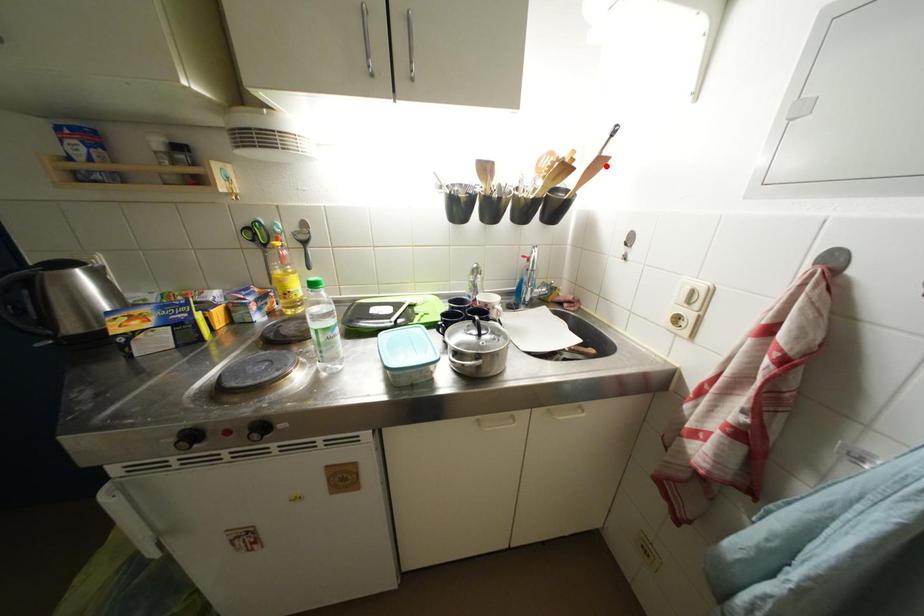
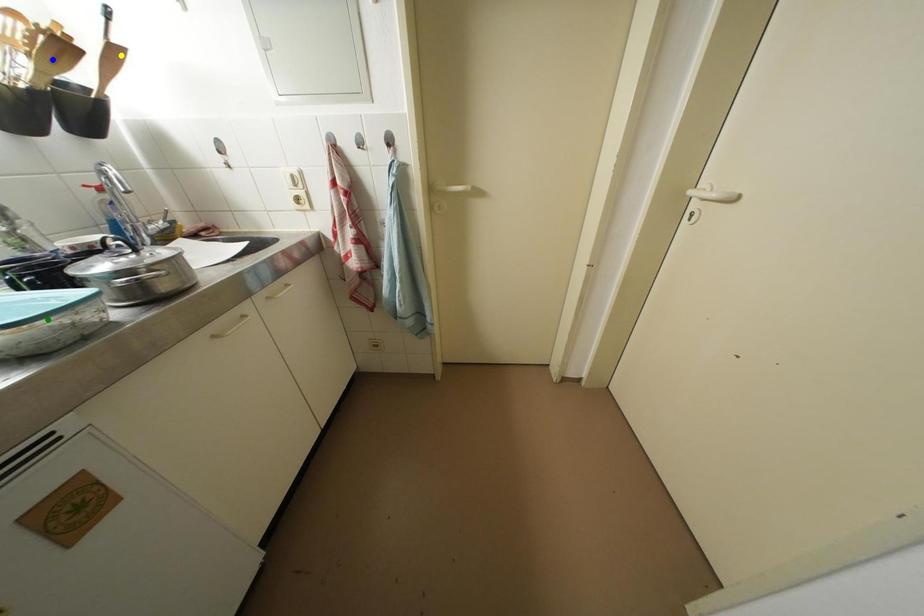
Question: I am providing you with two images of the same scene from different viewpoints. A red point is marked on the first image. You are given multiple points on the second image. Which point in image 2 represents the same 3d spot as the red point in image 1?

Choices:
 (A) yellow point
 (B) blue point
 (C) green point

Answer: (A)